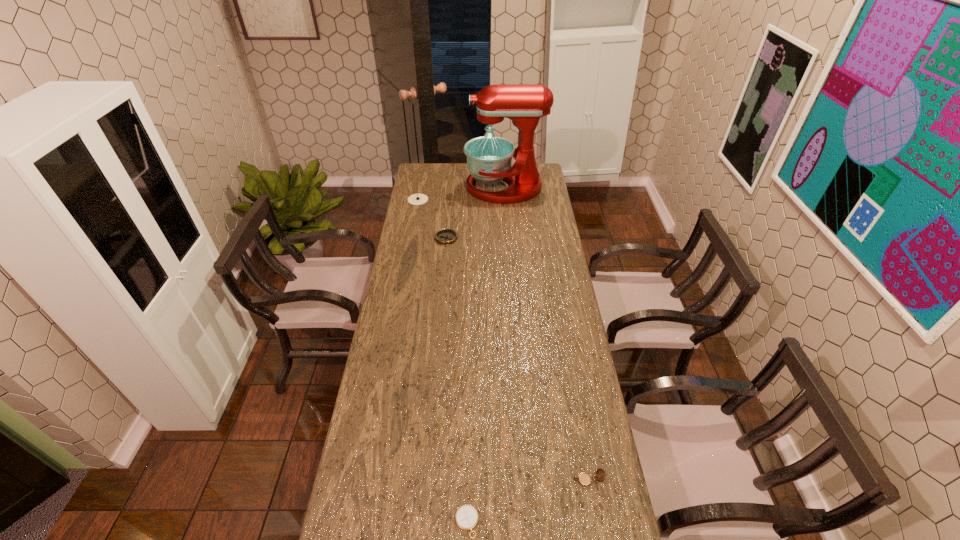
Where is `vacant space located on the front-facing side of the tallest object`? Image resolution: width=960 pixels, height=540 pixels. vacant space located on the front-facing side of the tallest object is located at coordinates point(439,187).

Locate an element on the screen. free space located 0.210m on the front-facing side of the tallest object is located at coordinates (426, 187).

Image resolution: width=960 pixels, height=540 pixels. In order to click on vacant region located 0.160m on the back of the leftmost compass in this screenshot , I will do `click(421, 179)`.

I want to click on vacant region located on the face of the second nearest compass, so click(533, 480).

The image size is (960, 540). In order to click on free point located 0.400m on the face of the second nearest compass in this screenshot , I will do pyautogui.click(x=431, y=480).

Identify the location of vacant space located on the face of the second nearest compass. The width and height of the screenshot is (960, 540). [x=530, y=480].

The width and height of the screenshot is (960, 540). Find the location of `vacant region located 0.120m on the back of the third compass from right to left`. vacant region located 0.120m on the back of the third compass from right to left is located at coordinates (448, 217).

You are a GUI agent. You are given a task and a screenshot of the screen. Output one action in this format:
    pyautogui.click(x=<x>, y=<y>)
    Task: Click on the vacant position located on the left of the shortest compass
    The height and width of the screenshot is (540, 960).
    Given the screenshot: What is the action you would take?
    [362, 522]

Locate an element on the screen. This screenshot has height=540, width=960. object located in the far edge section of the desktop is located at coordinates (489, 158).

Where is `mixer located at the right edge`? The image size is (960, 540). mixer located at the right edge is located at coordinates (489, 158).